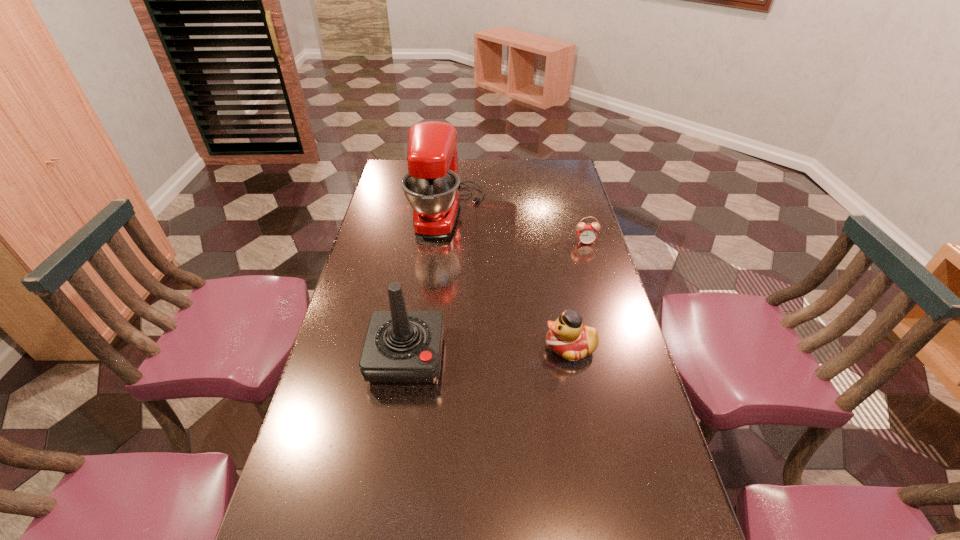
Locate an element on the screen. Image resolution: width=960 pixels, height=540 pixels. free space at the right edge of the desktop is located at coordinates (582, 401).

Locate an element on the screen. vacant area at the far right corner of the desktop is located at coordinates (543, 170).

This screenshot has height=540, width=960. I want to click on vacant space in between the third tallest object and the joystick, so click(489, 353).

Find the location of `free area in between the second tallest object and the tallest object`. free area in between the second tallest object and the tallest object is located at coordinates (427, 286).

In order to click on empty location between the third shortest object and the duck in this screenshot , I will do `click(489, 353)`.

In order to click on empty space between the joystick and the duck in this screenshot , I will do `click(489, 353)`.

This screenshot has height=540, width=960. What are the coordinates of `free point between the rightmost object and the kitchen mixer` in the screenshot? It's located at (516, 227).

Where is `free spot between the second shortest object and the shortest object`? free spot between the second shortest object and the shortest object is located at coordinates (578, 294).

At what (x,y) coordinates should I click in order to perform the action: click on object that is the third closest to the kitchen mixer. Please return your answer as a coordinate pair (x, y). The image size is (960, 540). Looking at the image, I should click on (568, 337).

Locate which object ranks second in proximity to the kitchen mixer. Please provide its 2D coordinates. Your answer should be formatted as a tuple, i.e. [(x, y)], where the tuple contains the x and y coordinates of a point satisfying the conditions above.

[(401, 347)]